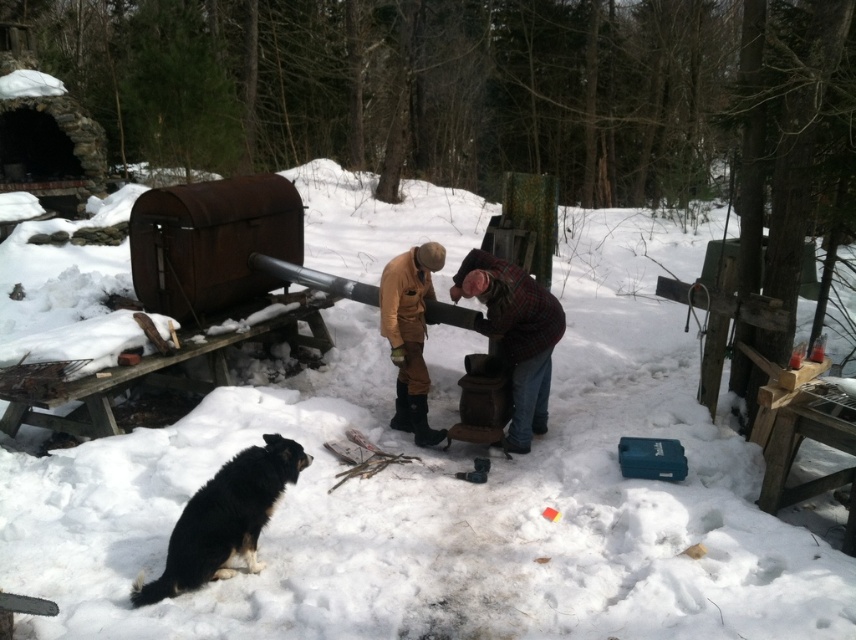
Question: Which of the following is the closest to the observer?

Choices:
 (A) brown suede boots at center
 (B) black fur dog at lower left

Answer: (B)

Question: Can you confirm if black fur dog at lower left is wider than brown suede boots at center?

Choices:
 (A) yes
 (B) no

Answer: (A)

Question: Does black fur dog at lower left have a larger size compared to plaid fabric shirt at center?

Choices:
 (A) yes
 (B) no

Answer: (B)

Question: Estimate the real-world distances between objects in this image. Which object is closer to the brown suede boots at center?

Choices:
 (A) plaid fabric shirt at center
 (B) black fur dog at lower left

Answer: (A)

Question: Which object is closer to the camera taking this photo?

Choices:
 (A) black fur dog at lower left
 (B) plaid fabric shirt at center
 (C) brown suede boots at center

Answer: (A)

Question: Is black fur dog at lower left to the left of brown suede boots at center from the viewer's perspective?

Choices:
 (A) yes
 (B) no

Answer: (A)